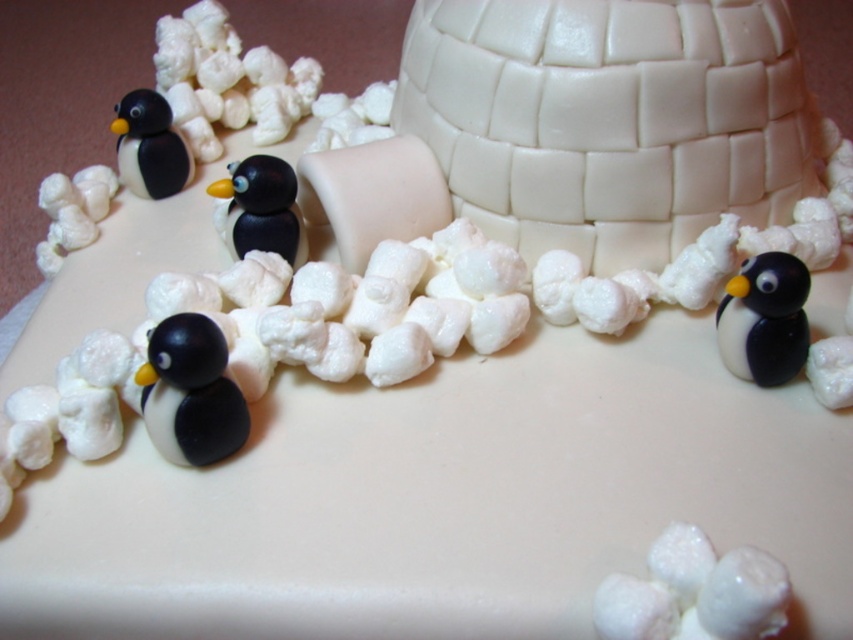
You are a guest at a winter themed birthday party and see the cake with a black glossy penguin at lower right and a black matte penguin at upper left. Which penguin is positioned lower on the cake?

The black glossy penguin at lower right is positioned lower on the cake than the black matte penguin at upper left.

You are a guest at a winter themed birthday party and see the cake with two penguins. The black glossy penguin at lower right and the black matte penguin at upper left. Which penguin is positioned more to the right side of the cake?

The black glossy penguin at lower right is positioned more to the right side of the cake than the black matte penguin at upper left.

Looking at this image, you are a guest at a winter themed birthday party and see the cake with a matte black penguin at lower left and a black matte penguin at upper left. Which penguin is closer to the ground?

The matte black penguin at lower left is closer to the ground since it is shorter than the black matte penguin at upper left.